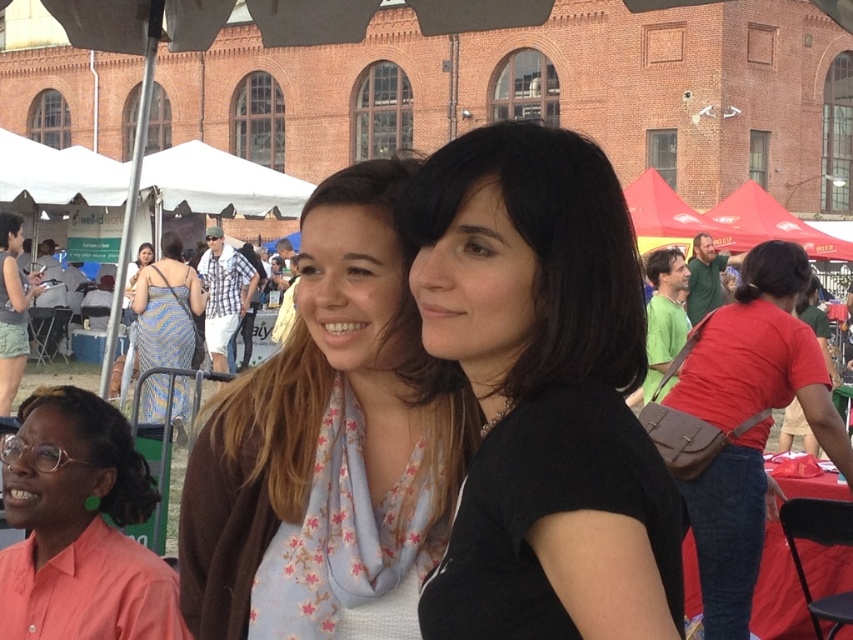
Question: Is metallic blue dress at center-left bigger than matte black laptop at left?

Choices:
 (A) no
 (B) yes

Answer: (B)

Question: Considering the relative positions of black matte shirt at center and metallic blue dress at center-left in the image provided, where is black matte shirt at center located with respect to metallic blue dress at center-left?

Choices:
 (A) below
 (B) above

Answer: (A)

Question: Which object is the farthest from the black matte shirt at center?

Choices:
 (A) brown leather bag at right
 (B) matte black laptop at left

Answer: (B)

Question: Is pink fabric shirt at lower left positioned in front of metallic blue dress at center-left?

Choices:
 (A) no
 (B) yes

Answer: (B)

Question: Which point is farther to the camera?

Choices:
 (A) matte black laptop at left
 (B) brown leather bag at right
 (C) pink fabric shirt at lower left
 (D) metallic blue dress at center-left

Answer: (A)

Question: Considering the real-world distances, which object is closest to the metallic blue dress at center-left?

Choices:
 (A) black matte shirt at center
 (B) pink fabric shirt at lower left
 (C) matte black laptop at left
 (D) light brown scarf at center

Answer: (C)